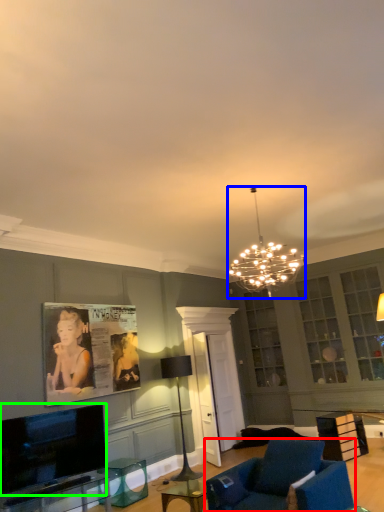
Question: Which is farther away from chair (highlighted by a red box)? lamp (highlighted by a blue box) or television (highlighted by a green box)?

Choices:
 (A) lamp
 (B) television

Answer: (A)